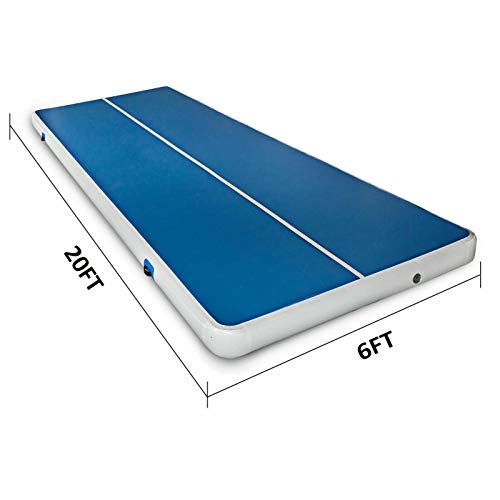
This screenshot has width=500, height=500. Find the location of `gym mat`. gym mat is located at coordinates (262, 270).